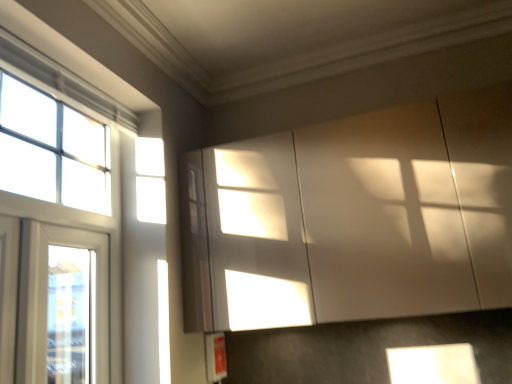
Find the location of a particular element. This screenshot has width=512, height=384. white glass window at left, which ranks as the 2th window in bottom-to-top order is located at coordinates (76, 222).

What is the approximate width of white glossy cabinet at upper right?

The width of white glossy cabinet at upper right is 14.90 inches.

This screenshot has height=384, width=512. Describe the element at coordinates (353, 218) in the screenshot. I see `white glossy cabinet at upper right` at that location.

This screenshot has width=512, height=384. Describe the element at coordinates (63, 305) in the screenshot. I see `white glass window at left, the 3th window when ordered from top to bottom` at that location.

From the picture: In order to face clear glass window at upper left, which appears as the 1th window when viewed from the top, should I rotate leftwards or rightwards?

To face it directly, rotate left by 23.814 degrees.

Where is `white glass window at left, which ranks as the 2th window in bottom-to-top order`? The image size is (512, 384). white glass window at left, which ranks as the 2th window in bottom-to-top order is located at coordinates (76, 222).

In terms of height, does clear glass window at upper left, placed as the third window when sorted from bottom to top, look taller or shorter compared to white glossy cabinet at upper right?

Clearly, clear glass window at upper left, placed as the third window when sorted from bottom to top, is shorter compared to white glossy cabinet at upper right.

This screenshot has height=384, width=512. In order to click on cabinetry below the clear glass window at upper left, which appears as the 1th window when viewed from the top (from the image's perspective) in this screenshot , I will do `click(353, 218)`.

Can you tell me how much clear glass window at upper left, which appears as the 1th window when viewed from the top, and white glossy cabinet at upper right differ in facing direction?

clear glass window at upper left, which appears as the 1th window when viewed from the top, and white glossy cabinet at upper right are facing 90.6 degrees away from each other.

Does clear glass window at upper left, placed as the third window when sorted from bottom to top, have a greater width compared to white glossy cabinet at upper right?

No.

Looking at this image, from a real-world perspective, who is located lower, white glass window at left, acting as the first window starting from the bottom, or clear glass window at upper left, placed as the third window when sorted from bottom to top?

white glass window at left, acting as the first window starting from the bottom.

Between white glass window at left, the 3th window when ordered from top to bottom, and clear glass window at upper left, which appears as the 1th window when viewed from the top, which one has larger size?

white glass window at left, the 3th window when ordered from top to bottom, is bigger.

How different are the orientations of white glass window at left, acting as the first window starting from the bottom, and clear glass window at upper left, placed as the third window when sorted from bottom to top, in degrees?

They differ by 0.0012 degrees in their facing directions.

From the picture: Does white glass window at left, the 3th window when ordered from top to bottom, lie in front of clear glass window at upper left, placed as the third window when sorted from bottom to top?

No, it is not.

From the image's perspective, between clear glass window at upper left, placed as the third window when sorted from bottom to top, and white glass window at left, the 3th window when ordered from top to bottom, who is located below?

From the image's view, white glass window at left, the 3th window when ordered from top to bottom, is below.

Starting from the white glass window at left, acting as the first window starting from the bottom, which window is the 1st one in front? Please provide its 2D coordinates.

[(52, 150)]

Is white glass window at left, acting as the first window starting from the bottom, a part of clear glass window at upper left, which appears as the 1th window when viewed from the top?

No.

Considering the positions of objects clear glass window at upper left, which appears as the 1th window when viewed from the top, and white glass window at left, acting as the first window starting from the bottom, in the image provided, who is behind, clear glass window at upper left, which appears as the 1th window when viewed from the top, or white glass window at left, acting as the first window starting from the bottom,?

white glass window at left, acting as the first window starting from the bottom, is further away from the camera.

Is point (40, 345) closer to viewer compared to point (482, 247)?

Yes, point (40, 345) is closer to viewer.

From the image's perspective, between white glass window at left, the 3th window when ordered from top to bottom, and white glossy cabinet at upper right, which one is located above?

white glossy cabinet at upper right, from the image's perspective.

Image resolution: width=512 pixels, height=384 pixels. I want to click on cabinetry on the right of white glass window at left, acting as the first window starting from the bottom, so click(x=353, y=218).

Could you tell me if white glass window at left, acting as the first window starting from the bottom, is turned towards white glossy cabinet at upper right?

No, white glass window at left, acting as the first window starting from the bottom, is not oriented towards white glossy cabinet at upper right.

Is white glass window at left, the 3th window when ordered from top to bottom, closer to the viewer compared to white glass window at left, placed as the 2th window when sorted from top to bottom?

No, white glass window at left, the 3th window when ordered from top to bottom, is behind white glass window at left, placed as the 2th window when sorted from top to bottom.

Is white glass window at left, the 3th window when ordered from top to bottom, at the right side of white glass window at left, placed as the 2th window when sorted from top to bottom?

Indeed, white glass window at left, the 3th window when ordered from top to bottom, is positioned on the right side of white glass window at left, placed as the 2th window when sorted from top to bottom.

In terms of width, does white glass window at left, the 3th window when ordered from top to bottom, look wider or thinner when compared to white glass window at left, placed as the 2th window when sorted from top to bottom?

Considering their sizes, white glass window at left, the 3th window when ordered from top to bottom, looks broader than white glass window at left, placed as the 2th window when sorted from top to bottom.

From the image's perspective, is clear glass window at upper left, which appears as the 1th window when viewed from the top, located above white glass window at left, which ranks as the 2th window in bottom-to-top order?

Yes, from the image's perspective, clear glass window at upper left, which appears as the 1th window when viewed from the top, is over white glass window at left, which ranks as the 2th window in bottom-to-top order.

Is clear glass window at upper left, placed as the third window when sorted from bottom to top, situated inside white glass window at left, placed as the 2th window when sorted from top to bottom, or outside?

clear glass window at upper left, placed as the third window when sorted from bottom to top, is enclosed within white glass window at left, placed as the 2th window when sorted from top to bottom.

Considering the relative sizes of clear glass window at upper left, placed as the third window when sorted from bottom to top, and white glass window at left, which ranks as the 2th window in bottom-to-top order, in the image provided, is clear glass window at upper left, placed as the third window when sorted from bottom to top, thinner than white glass window at left, which ranks as the 2th window in bottom-to-top order,?

Correct, the width of clear glass window at upper left, placed as the third window when sorted from bottom to top, is less than that of white glass window at left, which ranks as the 2th window in bottom-to-top order.

You are a GUI agent. You are given a task and a screenshot of the screen. Output one action in this format:
    pyautogui.click(x=<x>, y=<y>)
    Task: Click on the window above the white glass window at left, placed as the 2th window when sorted from top to bottom (from a real-world perspective)
    
    Given the screenshot: What is the action you would take?
    pos(52,150)

Measure the distance between white glass window at left, placed as the 2th window when sorted from top to bottom, and white glossy cabinet at upper right.

white glass window at left, placed as the 2th window when sorted from top to bottom, is 25.03 inches from white glossy cabinet at upper right.

Is white glass window at left, which ranks as the 2th window in bottom-to-top order, located outside white glossy cabinet at upper right?

Yes, white glass window at left, which ranks as the 2th window in bottom-to-top order, is outside of white glossy cabinet at upper right.

Considering the sizes of objects white glass window at left, which ranks as the 2th window in bottom-to-top order, and white glossy cabinet at upper right in the image provided, who is taller, white glass window at left, which ranks as the 2th window in bottom-to-top order, or white glossy cabinet at upper right?

white glass window at left, which ranks as the 2th window in bottom-to-top order, is taller.

Which of these two, white glass window at left, which ranks as the 2th window in bottom-to-top order, or white glossy cabinet at upper right, is bigger?

white glossy cabinet at upper right.

The width and height of the screenshot is (512, 384). I want to click on cabinetry below the clear glass window at upper left, placed as the third window when sorted from bottom to top (from the image's perspective), so click(353, 218).

Starting from the clear glass window at upper left, which appears as the 1th window when viewed from the top, which window is the 2nd one to the right? Please provide its 2D coordinates.

[(63, 305)]

Based on their spatial positions, is white glass window at left, placed as the 2th window when sorted from top to bottom, or clear glass window at upper left, placed as the third window when sorted from bottom to top, further from white glass window at left, the 3th window when ordered from top to bottom?

Among the two, clear glass window at upper left, placed as the third window when sorted from bottom to top, is located further to white glass window at left, the 3th window when ordered from top to bottom.

From the image, which object appears to be farther from white glass window at left, which ranks as the 2th window in bottom-to-top order, clear glass window at upper left, placed as the third window when sorted from bottom to top, or white glass window at left, the 3th window when ordered from top to bottom?

white glass window at left, the 3th window when ordered from top to bottom, is further to white glass window at left, which ranks as the 2th window in bottom-to-top order.

From the image, which object appears to be farther from white glass window at left, acting as the first window starting from the bottom, clear glass window at upper left, placed as the third window when sorted from bottom to top, or white glossy cabinet at upper right?

white glossy cabinet at upper right lies further to white glass window at left, acting as the first window starting from the bottom, than the other object.

When comparing their distances from white glass window at left, acting as the first window starting from the bottom, does white glossy cabinet at upper right or white glass window at left, which ranks as the 2th window in bottom-to-top order, seem closer?

Based on the image, white glass window at left, which ranks as the 2th window in bottom-to-top order, appears to be nearer to white glass window at left, acting as the first window starting from the bottom.

When comparing their distances from white glossy cabinet at upper right, does white glass window at left, which ranks as the 2th window in bottom-to-top order, or white glass window at left, acting as the first window starting from the bottom, seem further?

The object further to white glossy cabinet at upper right is white glass window at left, acting as the first window starting from the bottom.

Looking at the image, which one is located closer to white glossy cabinet at upper right, white glass window at left, placed as the 2th window when sorted from top to bottom, or clear glass window at upper left, placed as the third window when sorted from bottom to top?

white glass window at left, placed as the 2th window when sorted from top to bottom, is positioned closer to the anchor white glossy cabinet at upper right.

Estimate the real-world distances between objects in this image. Which object is further from clear glass window at upper left, placed as the third window when sorted from bottom to top, white glossy cabinet at upper right or white glass window at left, placed as the 2th window when sorted from top to bottom?

white glossy cabinet at upper right lies further to clear glass window at upper left, placed as the third window when sorted from bottom to top, than the other object.

Looking at the image, which one is located closer to clear glass window at upper left, which appears as the 1th window when viewed from the top, white glass window at left, which ranks as the 2th window in bottom-to-top order, or white glass window at left, acting as the first window starting from the bottom?

white glass window at left, which ranks as the 2th window in bottom-to-top order.

You are a GUI agent. You are given a task and a screenshot of the screen. Output one action in this format:
    pyautogui.click(x=<x>, y=<y>)
    Task: Click on the window between clear glass window at upper left, placed as the third window when sorted from bottom to top, and white glass window at left, acting as the first window starting from the bottom, vertically
    The width and height of the screenshot is (512, 384).
    Given the screenshot: What is the action you would take?
    pyautogui.click(x=76, y=222)

Where is `window located between white glass window at left, placed as the 2th window when sorted from top to bottom, and white glossy cabinet at upper right in the left-right direction`? The image size is (512, 384). window located between white glass window at left, placed as the 2th window when sorted from top to bottom, and white glossy cabinet at upper right in the left-right direction is located at coordinates (63, 305).